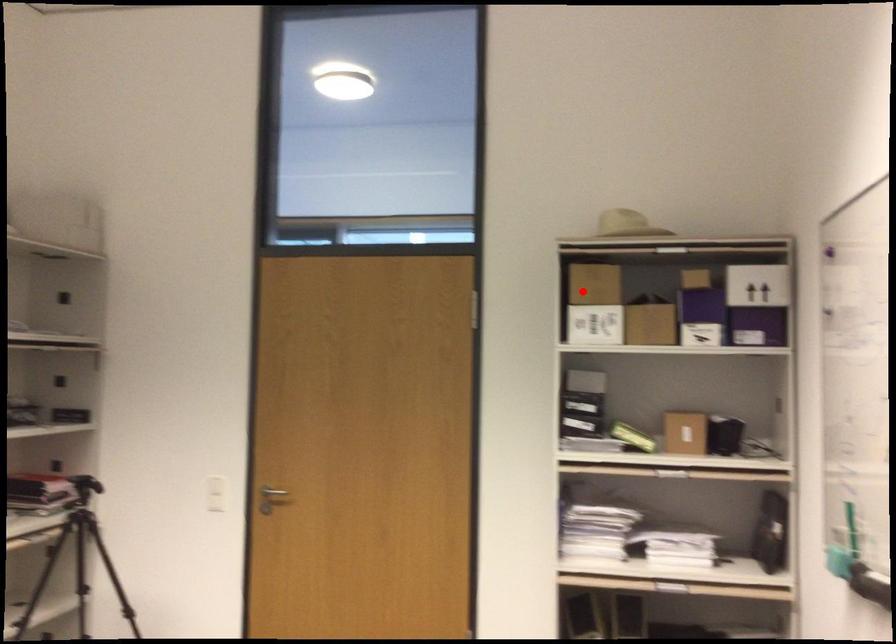
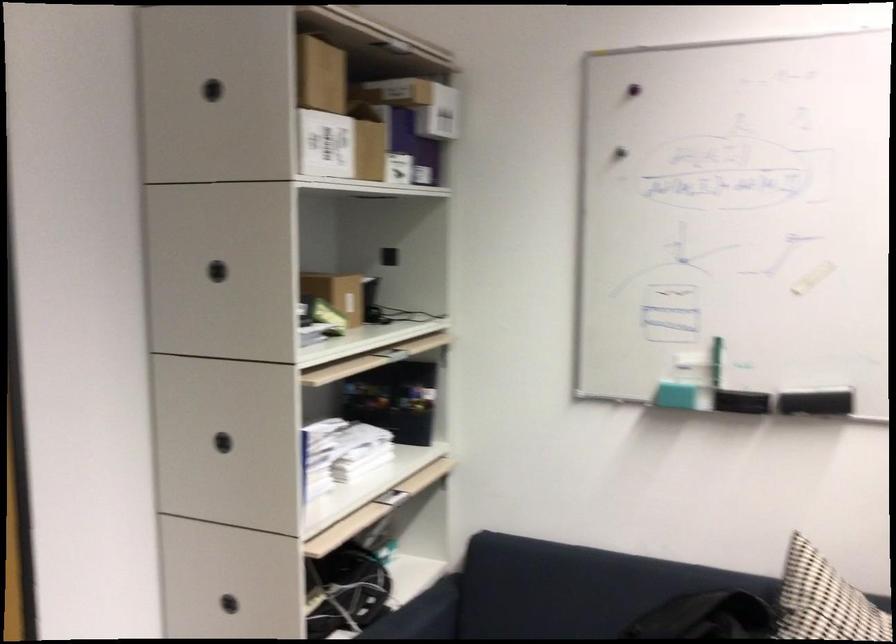
Question: A red point is marked in image1. In image2, is the corresponding 3D point closer to the camera or farther? Reply with the corresponding letter.

Choices:
 (A) The corresponding 3D point is closer.
 (B) The corresponding 3D point is farther.

Answer: (A)